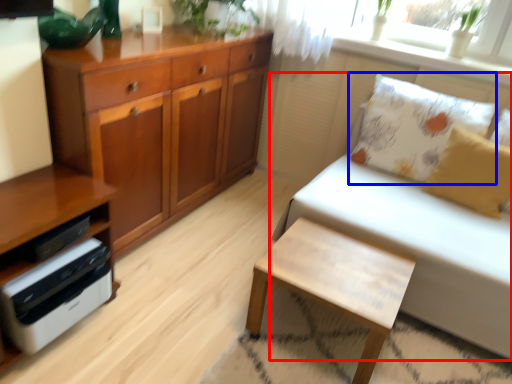
Question: Which object is further to the camera taking this photo, studio couch (highlighted by a red box) or pillow (highlighted by a blue box)?

Choices:
 (A) studio couch
 (B) pillow

Answer: (B)